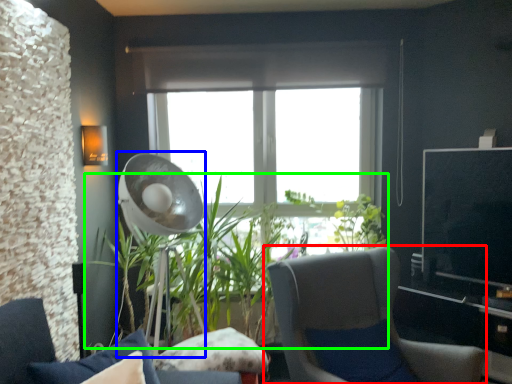
Question: Estimate the real-world distances between objects in this image. Which object is farther from chair (highlighted by a red box), mechanical fan (highlighted by a blue box) or houseplant (highlighted by a green box)?

Choices:
 (A) mechanical fan
 (B) houseplant

Answer: (A)